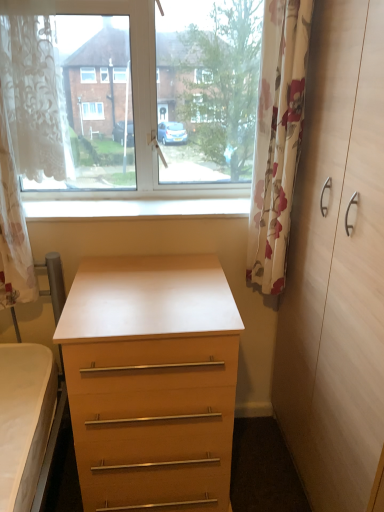
Question: Does point (297, 77) appear closer or farther from the camera than point (278, 410)?

Choices:
 (A) closer
 (B) farther

Answer: (A)

Question: Visually, is floral fabric curtain at right, which is the 1th curtain from right to left, positioned to the left or to the right of light wood dresser at right?

Choices:
 (A) left
 (B) right

Answer: (A)

Question: Which object is the farthest from the white smooth window sill at center?

Choices:
 (A) floral fabric curtain at right, which is the 1th curtain from right to left
 (B) transparent glass window at upper center
 (C) matte wood chest of drawers at center
 (D) white lace curtain at left, which is the 2th curtain from right to left
 (E) light wood dresser at right

Answer: (E)

Question: Based on their relative distances, which object is farther from the floral fabric curtain at right, arranged as the second curtain when viewed from the left?

Choices:
 (A) light wood dresser at right
 (B) transparent glass window at upper center
 (C) matte wood chest of drawers at center
 (D) white lace curtain at left, the first curtain positioned from the left
 (E) white smooth window sill at center

Answer: (D)